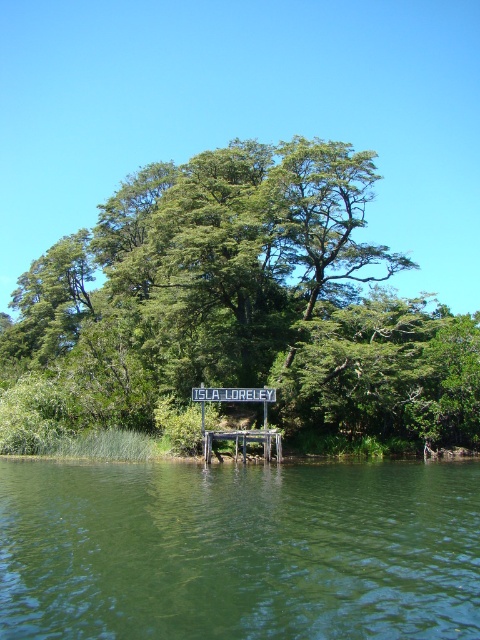
You are planning to place a small floating platform on the green smooth water at center. The wooden dock at center is currently occupying part of the water area. Can the platform fit in the remaining space?

The green smooth water at center is larger in size than the wooden dock at center, so there should be enough space left on the water to accommodate the small floating platform after accounting for the dock.

You are standing on the wooden dock at center and want to climb the green leafy tree at center. Which one is taller so you can decide if you need a ladder?

The green leafy tree at center is taller than the wooden dock at center, so you will need a ladder to climb it.

You are standing on the wooden pier and want to place a bench between the green leafy tree at center and the green smooth water at center. Which side of the bench should face the wider object?

The green leafy tree at center is wider than the green smooth water at center. Therefore, the bench should face the green leafy tree at center since it is the wider object.